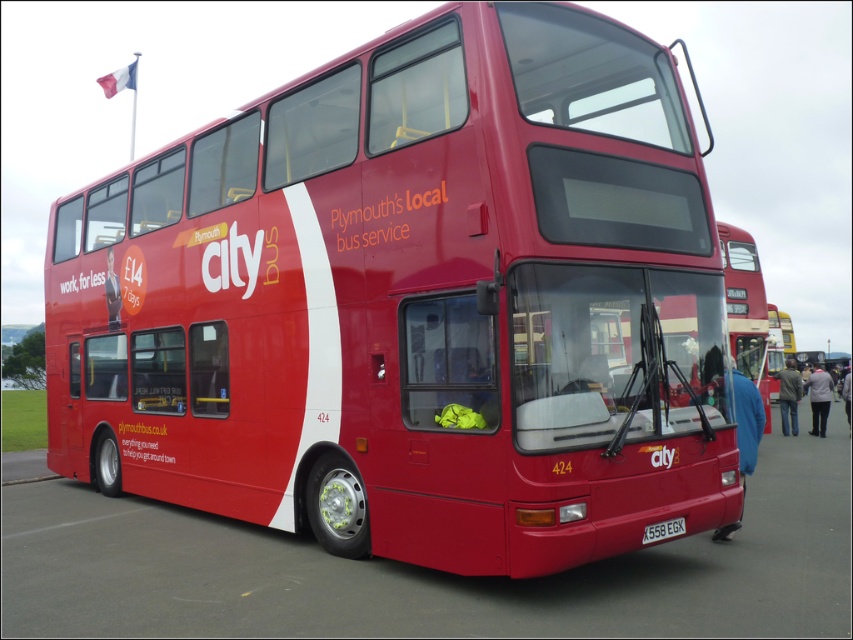
Between point (306, 582) and point (677, 529), which one is positioned in front?

Point (677, 529)

Does red rubber parking lot at lower center have a greater width compared to black plastic license plate at center?

Correct, the width of red rubber parking lot at lower center exceeds that of black plastic license plate at center.

Locate an element on the screen. This screenshot has height=640, width=853. red rubber parking lot at lower center is located at coordinates (426, 572).

Based on the photo, can you confirm if shiny red bus at center is taller than black plastic license plate at center?

Yes, shiny red bus at center is taller than black plastic license plate at center.

Is point (260, 433) positioned before point (656, 531)?

No, (260, 433) is further to viewer.

Does point (578, 310) come farther from viewer compared to point (657, 532)?

No.

Image resolution: width=853 pixels, height=640 pixels. I want to click on shiny red bus at center, so click(412, 304).

Which is more to the right, shiny red bus at center or red rubber parking lot at lower center?

red rubber parking lot at lower center is more to the right.

This screenshot has width=853, height=640. Identify the location of shiny red bus at center. (412, 304).

Does point (259, 288) lie behind point (178, 550)?

Yes.

Locate an element on the screen. Image resolution: width=853 pixels, height=640 pixels. shiny red bus at center is located at coordinates (412, 304).